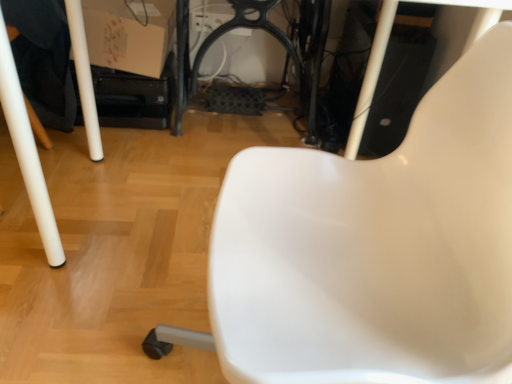
Question: Considering the relative sizes of white plastic chair at center and matte cardboard box at upper left in the image provided, is white plastic chair at center shorter than matte cardboard box at upper left?

Choices:
 (A) yes
 (B) no

Answer: (B)

Question: Can you confirm if white plastic chair at center is wider than matte cardboard box at upper left?

Choices:
 (A) yes
 (B) no

Answer: (A)

Question: Could you tell me if white plastic chair at center is facing matte cardboard box at upper left?

Choices:
 (A) no
 (B) yes

Answer: (A)

Question: From the image's perspective, would you say white plastic chair at center is shown under matte cardboard box at upper left?

Choices:
 (A) yes
 (B) no

Answer: (A)

Question: From a real-world perspective, is white plastic chair at center located beneath matte cardboard box at upper left?

Choices:
 (A) yes
 (B) no

Answer: (B)

Question: Are white plastic chair at center and matte cardboard box at upper left making contact?

Choices:
 (A) yes
 (B) no

Answer: (B)

Question: From the image's perspective, does matte cardboard box at upper left appear higher than white plastic chair at center?

Choices:
 (A) no
 (B) yes

Answer: (B)

Question: Is white plastic chair at center at the back of matte cardboard box at upper left?

Choices:
 (A) yes
 (B) no

Answer: (B)

Question: Can you confirm if matte cardboard box at upper left is shorter than white plastic chair at center?

Choices:
 (A) no
 (B) yes

Answer: (B)

Question: From the image's perspective, does matte cardboard box at upper left appear lower than white plastic chair at center?

Choices:
 (A) no
 (B) yes

Answer: (A)

Question: Does matte cardboard box at upper left lie behind white plastic chair at center?

Choices:
 (A) no
 (B) yes

Answer: (B)

Question: Does matte cardboard box at upper left turn towards white plastic chair at center?

Choices:
 (A) no
 (B) yes

Answer: (B)

Question: From their relative heights in the image, would you say white plastic chair at center is taller or shorter than matte cardboard box at upper left?

Choices:
 (A) short
 (B) tall

Answer: (B)